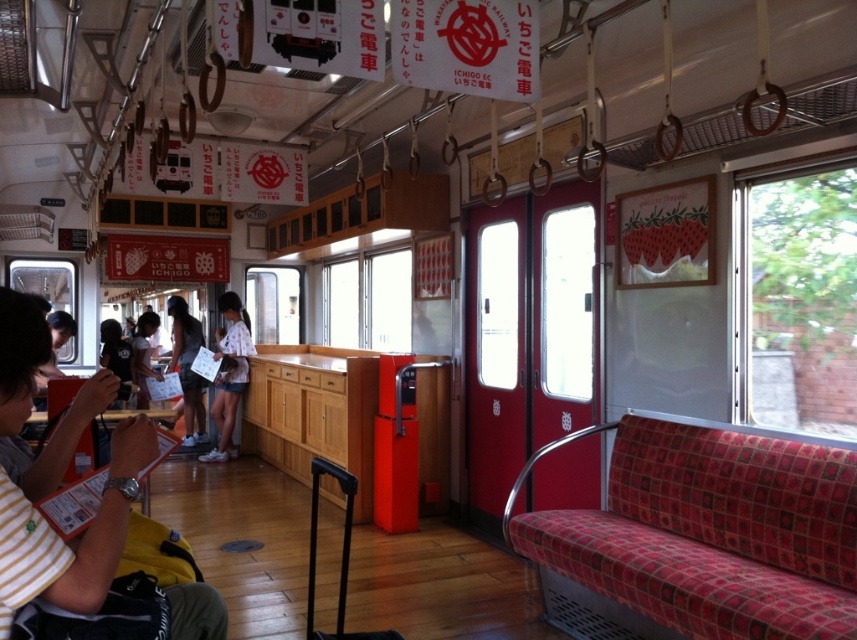
Does yellow fabric bag at left have a greater width compared to light blue denim shorts at center?

No, yellow fabric bag at left is not wider than light blue denim shorts at center.

Does yellow fabric bag at left appear on the right side of light blue denim shorts at center?

Indeed, yellow fabric bag at left is positioned on the right side of light blue denim shorts at center.

Does point (85, 410) lie behind point (148, 317)?

No, (85, 410) is closer to viewer.

This screenshot has height=640, width=857. Identify the location of yellow fabric bag at left. (88, 524).

Which is more to the right, yellow fabric bag at left or dark gray fabric shirt at center?

Positioned to the right is yellow fabric bag at left.

Is yellow fabric bag at left wider than dark gray fabric shirt at center?

Incorrect, yellow fabric bag at left's width does not surpass dark gray fabric shirt at center's.

Does point (69, 593) come behind point (186, 356)?

No, it is in front of (186, 356).

Find the location of `yellow fabric bag at left`. yellow fabric bag at left is located at coordinates (88, 524).

Does dark gray fabric shirt at center lie behind light blue denim shorts at center?

No, dark gray fabric shirt at center is closer to the viewer.

Is point (192, 332) closer to viewer compared to point (139, 384)?

That is False.

What do you see at coordinates (187, 369) in the screenshot? I see `dark gray fabric shirt at center` at bounding box center [187, 369].

Locate an element on the screen. dark gray fabric shirt at center is located at coordinates (187, 369).